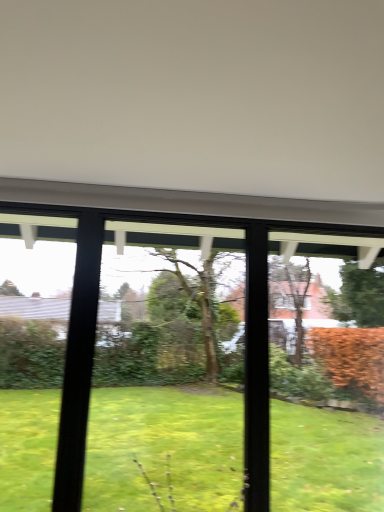
Looking at this image, measure the distance between transparent glass window at center and camera.

They are 1.27 meters apart.

The width and height of the screenshot is (384, 512). What do you see at coordinates (155, 325) in the screenshot?
I see `transparent glass window at center` at bounding box center [155, 325].

Image resolution: width=384 pixels, height=512 pixels. In order to click on transparent glass window at center in this screenshot , I will do `click(155, 325)`.

Where is `transparent glass window at center`? Image resolution: width=384 pixels, height=512 pixels. transparent glass window at center is located at coordinates (155, 325).